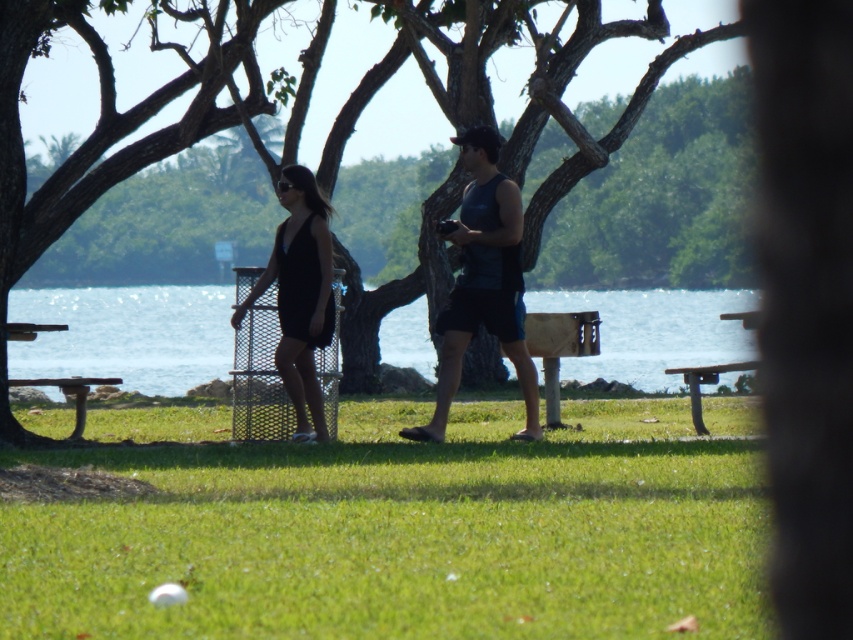
Between metallic silver picnic table at left and wooden picnic table at lower right, which one has more height?

Standing taller between the two is metallic silver picnic table at left.

Can you confirm if metallic silver picnic table at left is wider than wooden picnic table at lower right?

Indeed, metallic silver picnic table at left has a greater width compared to wooden picnic table at lower right.

Does point (13, 380) lie in front of point (694, 419)?

No, (13, 380) is further to viewer.

Locate an element on the screen. metallic silver picnic table at left is located at coordinates (68, 394).

Who is more forward, (340, 256) or (82, 384)?

Point (82, 384)

Is green leafy tree at center further to camera compared to wooden park bench at lower left?

No, it is not.

Which is behind, point (248, 42) or point (73, 392)?

The point (248, 42) is behind.

Locate an element on the screen. green leafy tree at center is located at coordinates (126, 120).

Looking at this image, is the position of dark blue tank top at center more distant than that of black matte dress at center?

No, it is not.

Between point (498, 179) and point (293, 365), which one is positioned in front?

Point (498, 179) is in front.

Where is `dark blue tank top at center`? This screenshot has height=640, width=853. dark blue tank top at center is located at coordinates (483, 282).